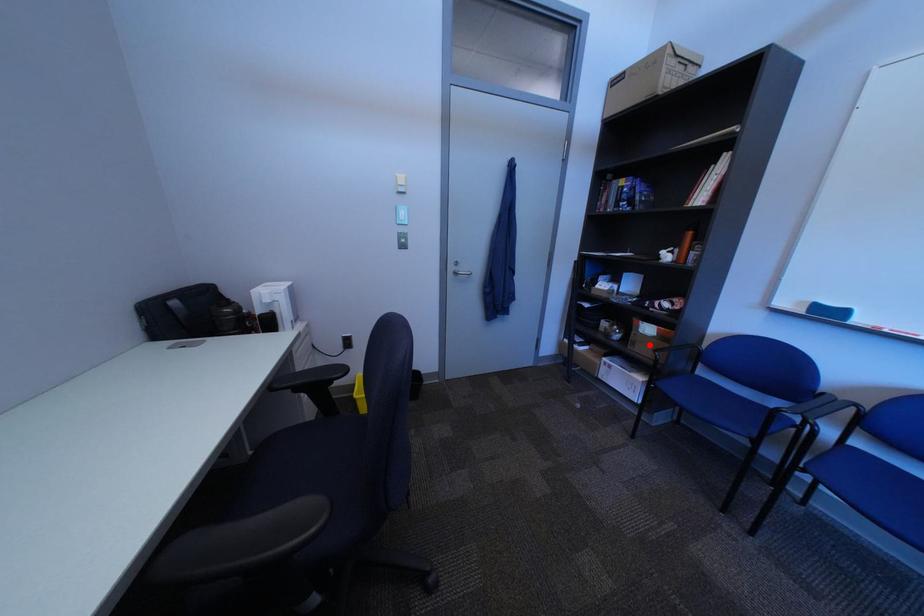
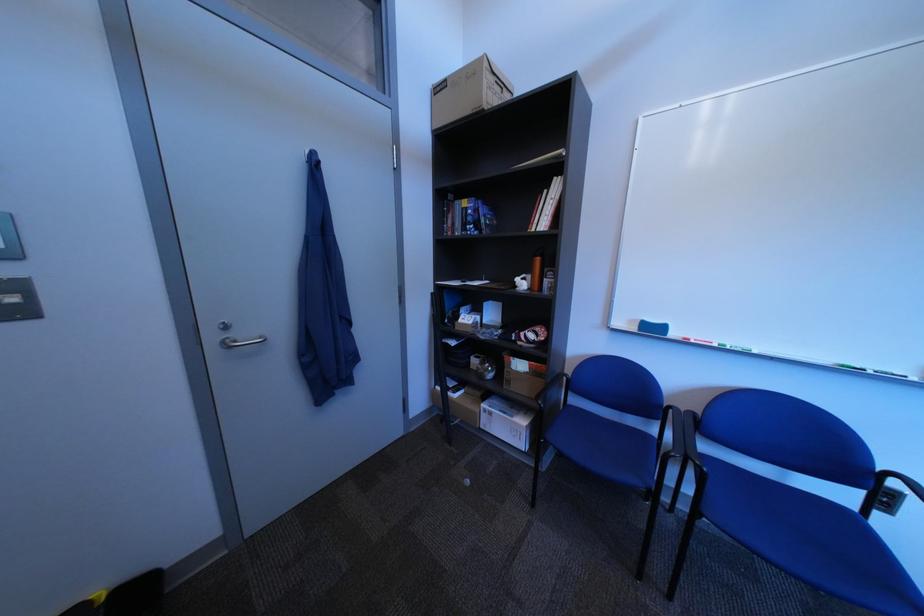
Where in the second image is the point corresponding to the highlighted location from the first image?

(525, 383)